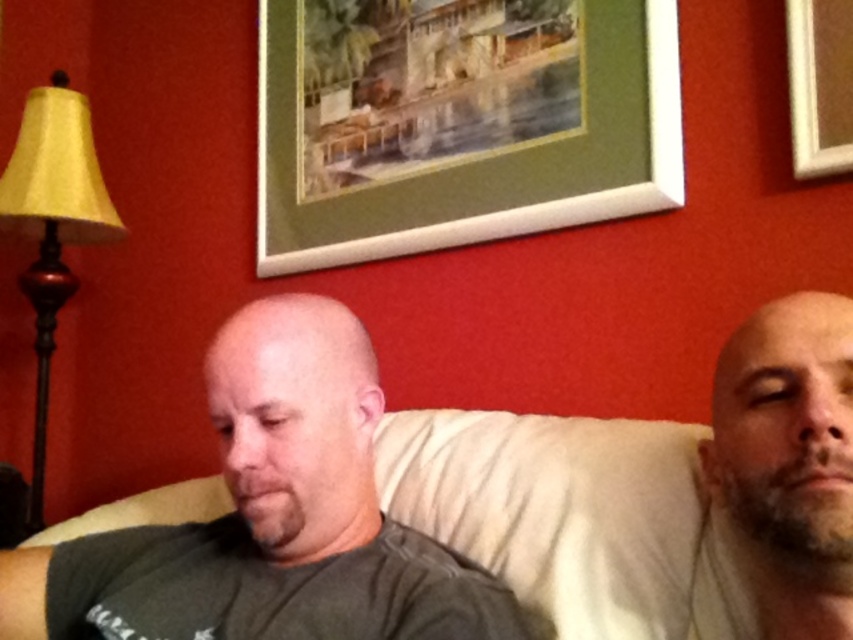
Question: Observing the image, what is the correct spatial positioning of matte yellow fabric lampshade at left in reference to wooden picture frame at upper right?

Choices:
 (A) above
 (B) below

Answer: (B)

Question: Which object is positioned farthest from the wooden picture frame at upper right?

Choices:
 (A) beige soft skin at right
 (B) green matte picture frame at upper center
 (C) matte yellow fabric lampshade at left
 (D) dark gray t-shirt at center

Answer: (C)

Question: Based on their relative distances, which object is nearer to the beige fabric couch at center?

Choices:
 (A) matte yellow fabric lampshade at left
 (B) green matte picture frame at upper center
 (C) beige soft skin at right

Answer: (C)

Question: Is dark gray t-shirt at center positioned behind matte yellow fabric lampshade at left?

Choices:
 (A) yes
 (B) no

Answer: (B)

Question: Is dark gray t-shirt at center positioned at the back of beige fabric couch at center?

Choices:
 (A) no
 (B) yes

Answer: (B)

Question: Considering the real-world distances, which object is closest to the matte yellow fabric lampshade at left?

Choices:
 (A) beige soft skin at right
 (B) beige fabric couch at center
 (C) green matte picture frame at upper center

Answer: (C)